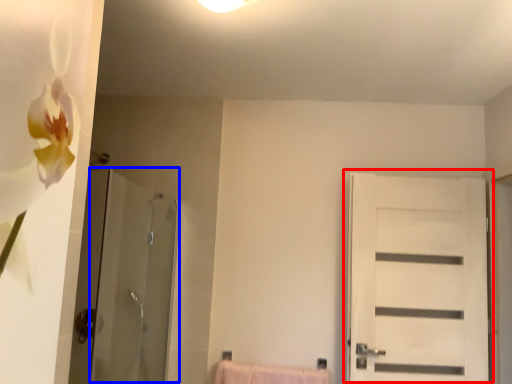
Question: Which of the following is the closest to the observer, door (highlighted by a red box) or screen door (highlighted by a blue box)?

Choices:
 (A) door
 (B) screen door

Answer: (B)